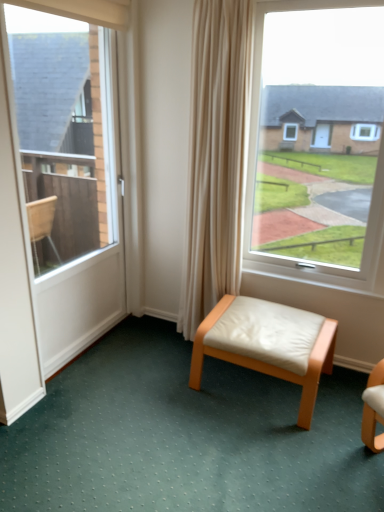
Locate an element on the screen. blank space to the left of white leather stool at center is located at coordinates (164, 385).